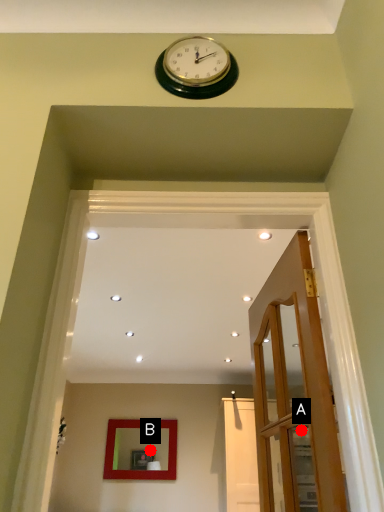
Question: Two points are circled on the image, labeled by A and B beside each circle. Which of the following is the closest to the observer?

Choices:
 (A) A is closer
 (B) B is closer

Answer: (A)